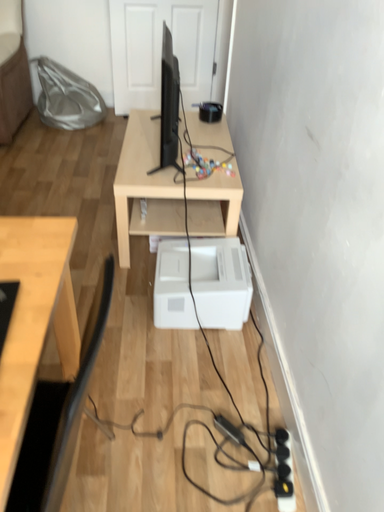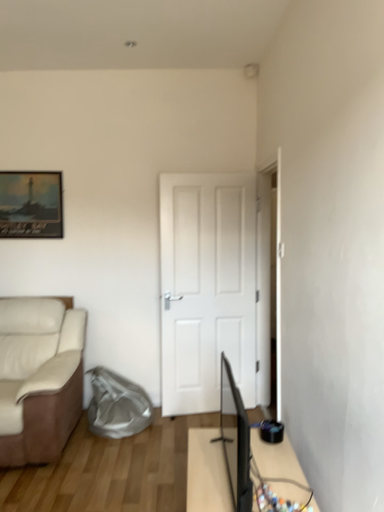
Question: Which way did the camera rotate in the video?

Choices:
 (A) rotated downward
 (B) rotated upward

Answer: (B)